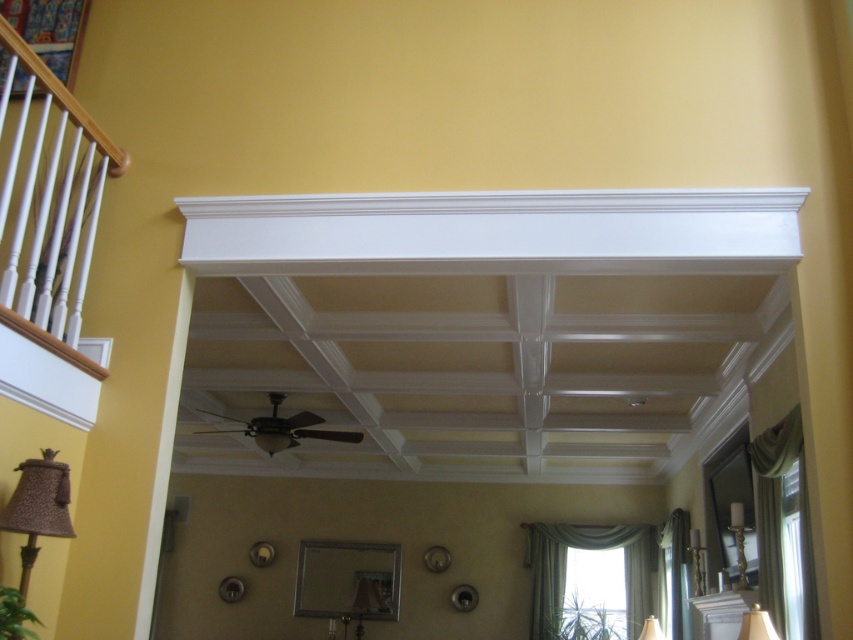
You are standing in the room and want to replace the shorter lampshade. Which one should you choose between the white fabric lampshade at lower right and the matte white lampshade at lower right?

The white fabric lampshade at lower right is not as tall as the matte white lampshade at lower right, so the shorter one is the white fabric lampshade at lower right. Therefore, you should choose the white fabric lampshade at lower right to replace the shorter one.